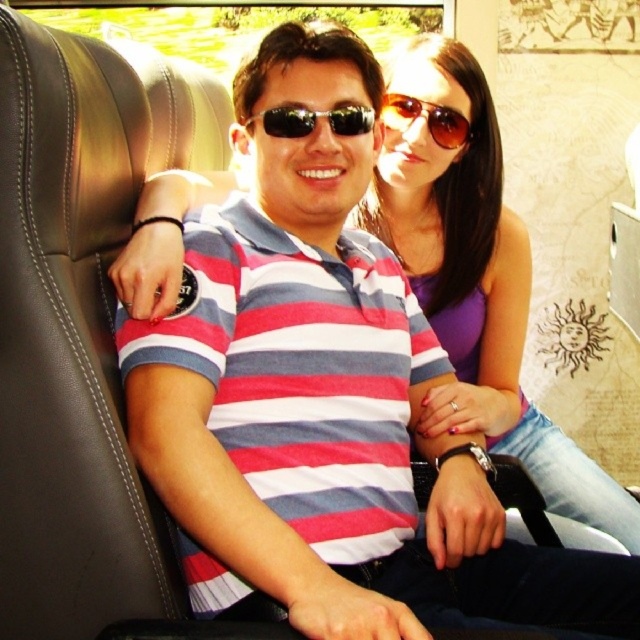
Can you confirm if black reflective sunglasses at center is bigger than sunglasses at upper center?

No.

The image size is (640, 640). Describe the element at coordinates (314, 120) in the screenshot. I see `black reflective sunglasses at center` at that location.

Locate an element on the screen. The height and width of the screenshot is (640, 640). black reflective sunglasses at center is located at coordinates (314, 120).